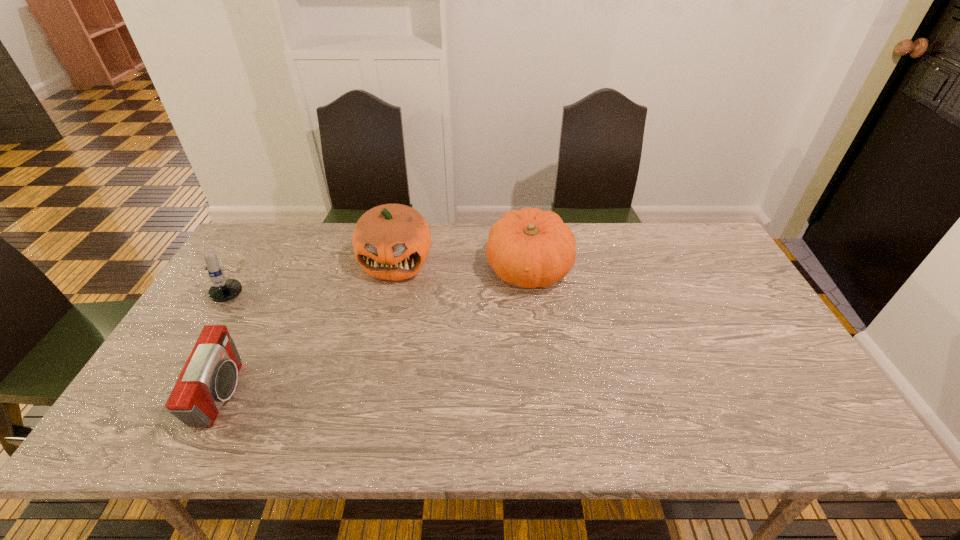
Where is `the third object from left to right`? This screenshot has width=960, height=540. the third object from left to right is located at coordinates (392, 241).

Locate an element on the screen. The image size is (960, 540). the right pumpkin is located at coordinates (530, 248).

Locate an element on the screen. This screenshot has width=960, height=540. the leftmost object is located at coordinates (223, 290).

Image resolution: width=960 pixels, height=540 pixels. I want to click on the second object from left to right, so click(x=209, y=378).

This screenshot has height=540, width=960. I want to click on the shortest object, so click(x=209, y=378).

The height and width of the screenshot is (540, 960). I want to click on vacant region located on the face of the left pumpkin, so click(x=381, y=327).

Identify the location of vacant space located on the left of the right pumpkin. The width and height of the screenshot is (960, 540). (460, 269).

At what (x,y) coordinates should I click in order to perform the action: click on free region located 0.060m on the back of the leftmost object. Please return your answer as a coordinate pair (x, y). The image size is (960, 540). Looking at the image, I should click on (258, 248).

Find the location of a particular element. The height and width of the screenshot is (540, 960). vacant region located on the front-facing side of the shortest object is located at coordinates (369, 394).

This screenshot has width=960, height=540. What are the coordinates of `microphone positioned at the far edge` in the screenshot? It's located at click(x=223, y=290).